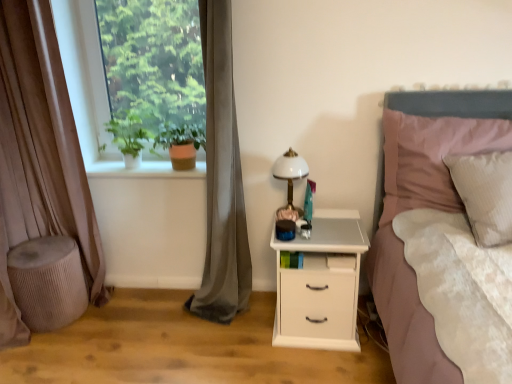
Where is `vacant space to the right of brown velvet curtain at left, which ranks as the 1th curtain in left-to-right order`? vacant space to the right of brown velvet curtain at left, which ranks as the 1th curtain in left-to-right order is located at coordinates (128, 308).